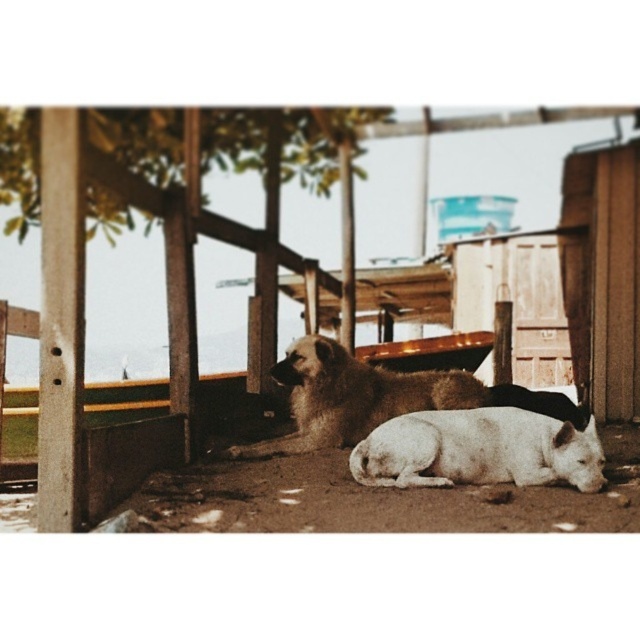
Question: Estimate the real-world distances between objects in this image. Which object is closer to the brown fur dog at center?

Choices:
 (A) white smooth dog at lower center
 (B) brown wooden dogs at center

Answer: (A)

Question: Can you confirm if brown wooden dogs at center is bigger than brown fur dog at center?

Choices:
 (A) no
 (B) yes

Answer: (A)

Question: Which object is the closest to the brown wooden dogs at center?

Choices:
 (A) white smooth dog at lower center
 (B) brown fur dog at center

Answer: (B)

Question: Can you confirm if white smooth dog at lower center is positioned below brown fur dog at center?

Choices:
 (A) yes
 (B) no

Answer: (A)

Question: Among these points, which one is farthest from the camera?

Choices:
 (A) (340, 388)
 (B) (182, 438)
 (C) (470, 433)

Answer: (A)

Question: Observing the image, what is the correct spatial positioning of brown wooden dogs at center in reference to white smooth dog at lower center?

Choices:
 (A) right
 (B) left

Answer: (B)